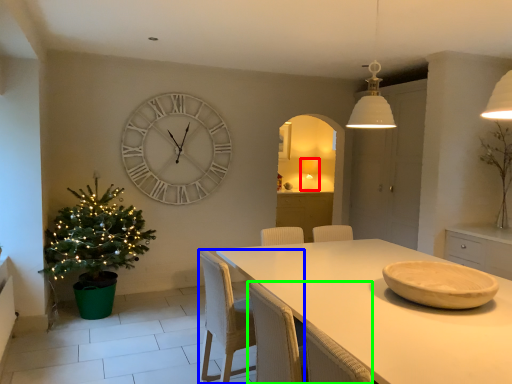
Question: Considering the real-world distances, which object is closest to lamp (highlighted by a red box)? chair (highlighted by a blue box) or armchair (highlighted by a green box).

Choices:
 (A) chair
 (B) armchair

Answer: (A)